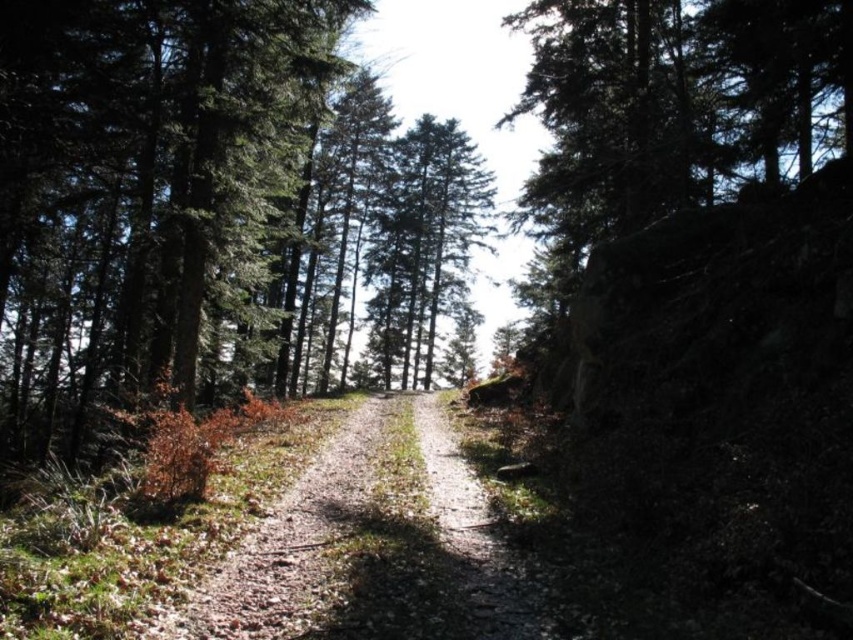
Question: Which of the following is the farthest from the observer?

Choices:
 (A) pos(260,378)
 (B) pos(294,522)

Answer: (A)

Question: Can you confirm if green textured tree at center is positioned to the left of dusty gravel path at center?

Choices:
 (A) no
 (B) yes

Answer: (B)

Question: Which of the following is the closest to the observer?

Choices:
 (A) (299, 570)
 (B) (161, 86)

Answer: (A)

Question: Which of the following is the farthest from the observer?

Choices:
 (A) (120, 305)
 (B) (433, 570)

Answer: (A)

Question: Observing the image, what is the correct spatial positioning of green textured tree at center in reference to dusty gravel path at center?

Choices:
 (A) left
 (B) right

Answer: (A)

Question: Is green textured tree at center to the left of dusty gravel path at center from the viewer's perspective?

Choices:
 (A) yes
 (B) no

Answer: (A)